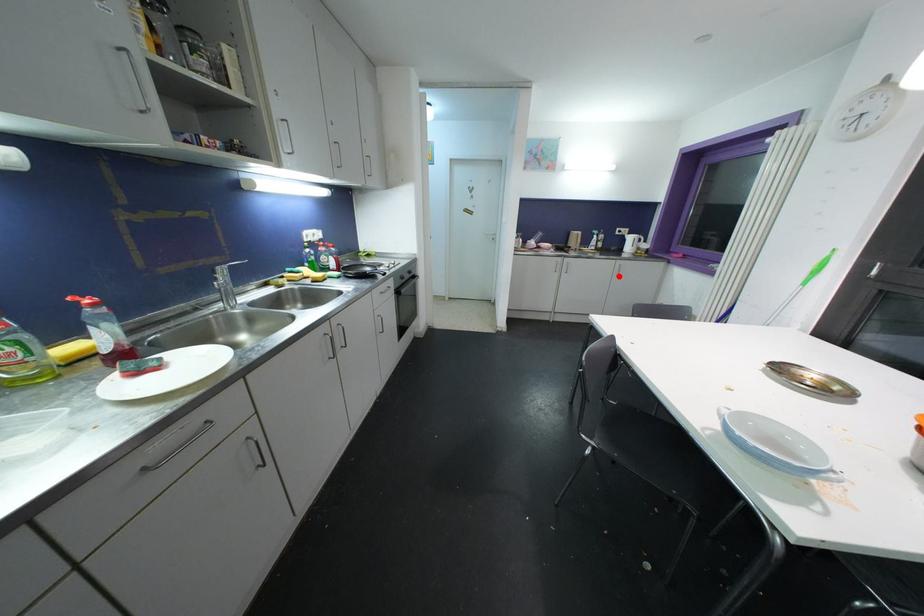
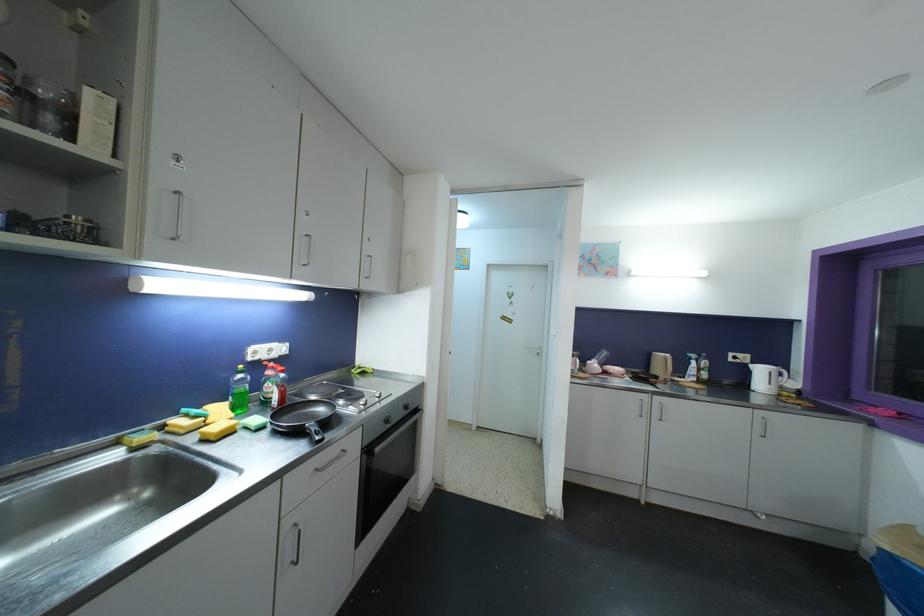
Question: I am providing you with two images of the same scene from different viewpoints. Image1 has a red point marked. In image2, the corresponding 3D location appears at what relative position? Reply with the corresponding letter.

Choices:
 (A) Closer
 (B) Farther

Answer: (B)